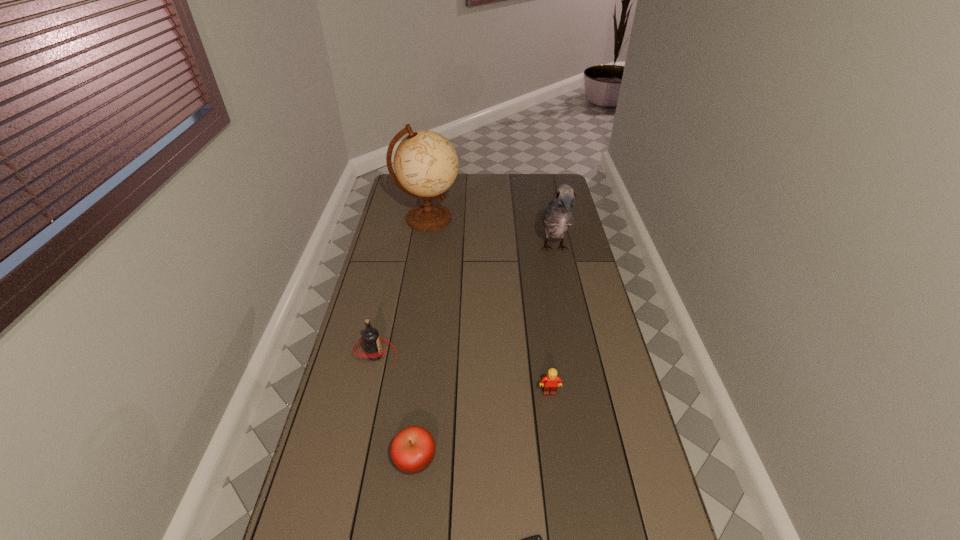
Image resolution: width=960 pixels, height=540 pixels. I want to click on free spot located on the label of the root beer, so click(x=437, y=355).

Locate an element on the screen. The image size is (960, 540). blank area located on the front of the fifth farthest object is located at coordinates (410, 509).

Locate an element on the screen. free spot located 0.190m on the face of the third nearest object is located at coordinates (558, 456).

Where is `globe at the left edge`? This screenshot has width=960, height=540. globe at the left edge is located at coordinates (426, 164).

The image size is (960, 540). Identify the location of root beer positioned at the left edge. (370, 337).

You are a GUI agent. You are given a task and a screenshot of the screen. Output one action in this format:
    pyautogui.click(x=<x>, y=<y>)
    Task: Click on the object that is at the right edge
    This screenshot has width=960, height=540.
    Given the screenshot: What is the action you would take?
    click(558, 216)

This screenshot has height=540, width=960. I want to click on free space at the left edge of the desktop, so (339, 416).

Locate an element on the screen. The image size is (960, 540). blank space at the right edge of the desktop is located at coordinates (617, 469).

Identify the location of vacant region at the far right corner. (550, 191).

Where is `free space between the apple and the fourth shortest object`? free space between the apple and the fourth shortest object is located at coordinates (396, 407).